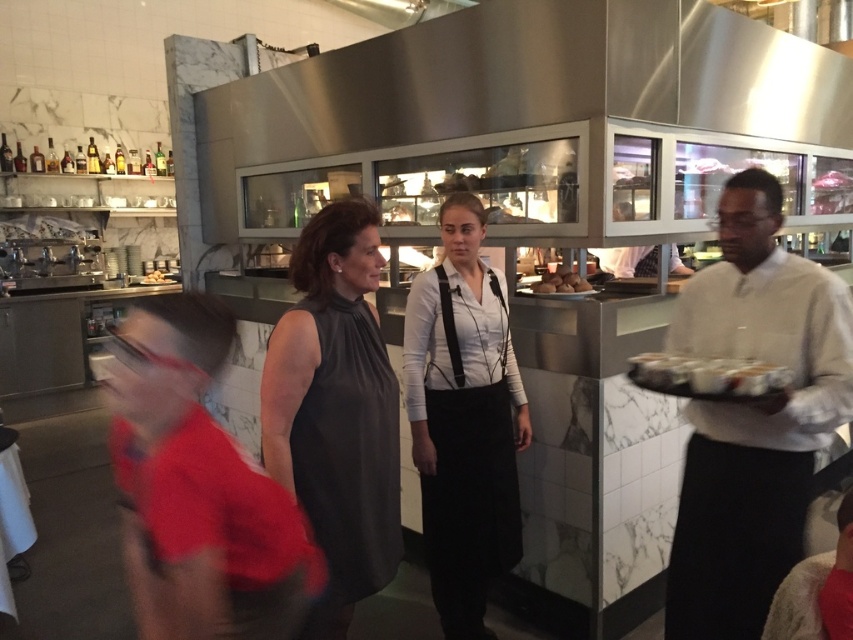
You are a customer in the restaurant and you want to grab the golden brown bread at center but there is a white glossy tray at right in the way. Can you reach the bread without moving the tray?

The distance between the white glossy tray at right and the golden brown bread at center is 5.63 meters, so you can easily reach the bread without moving the tray since they are far apart.

You are a customer in this restaurant and you see the dark gray sleeveless dress at center and the white glossy tray at right. Which object is taller?

The dark gray sleeveless dress at center is much taller as the white glossy tray at right.

You are standing in the restaurant and want to greet the woman in the dark gray sleeveless dress at center. The coordinates of the point where she is located are given as point (335, 410). If you move straight towards her position, will you pass through the kitchen area first?

The dark gray sleeveless dress at center is represented by point (335, 410). Since the kitchen area is in the background and the woman is in the foreground, moving straight towards her would not take you through the kitchen area first.